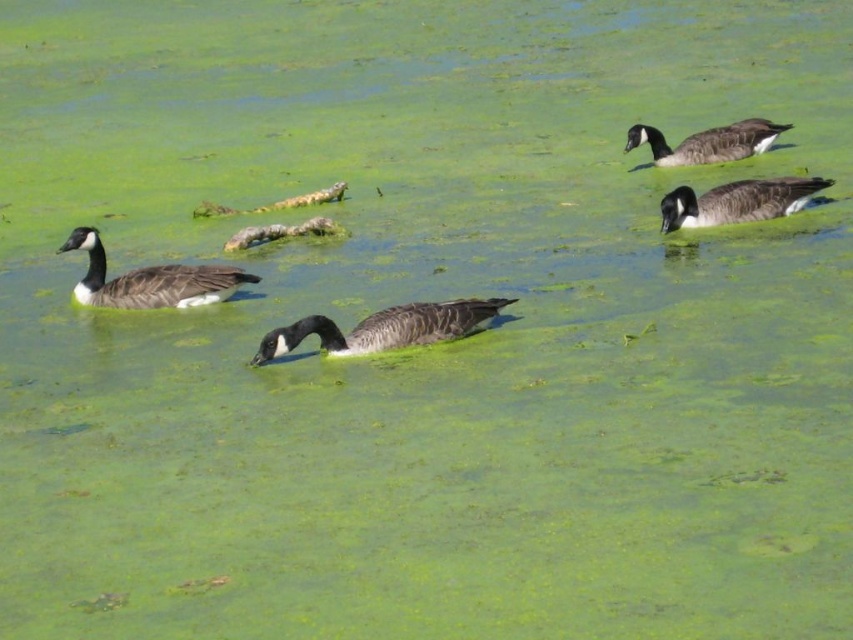
Question: Which point is closer to the camera?

Choices:
 (A) black glossy duck at center
 (B) dark gray matte duck at left
 (C) dark gray matte duck at upper right
 (D) dark gray matte duck at right

Answer: (A)

Question: Which point is closer to the camera?

Choices:
 (A) (106, 288)
 (B) (669, 220)
 (C) (722, 138)

Answer: (A)

Question: Can you confirm if black glossy duck at center is wider than dark gray matte duck at right?

Choices:
 (A) yes
 (B) no

Answer: (A)

Question: Which object is closer to the camera taking this photo?

Choices:
 (A) dark gray matte duck at left
 (B) black glossy duck at center
 (C) dark gray matte duck at right

Answer: (B)

Question: Can you confirm if black glossy duck at center is positioned below dark gray matte duck at left?

Choices:
 (A) yes
 (B) no

Answer: (A)

Question: Is dark gray matte duck at left further to camera compared to dark gray matte duck at upper right?

Choices:
 (A) yes
 (B) no

Answer: (B)